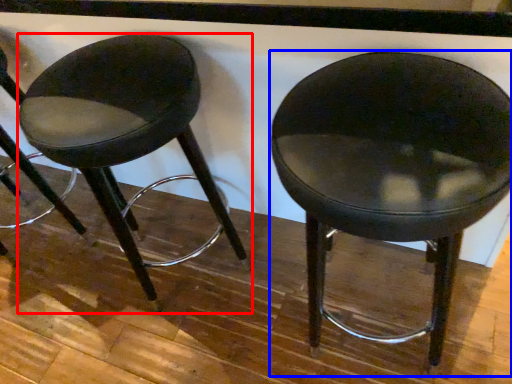
Question: Which object is closer to the camera taking this photo, stool (highlighted by a red box) or chair (highlighted by a blue box)?

Choices:
 (A) stool
 (B) chair

Answer: (B)